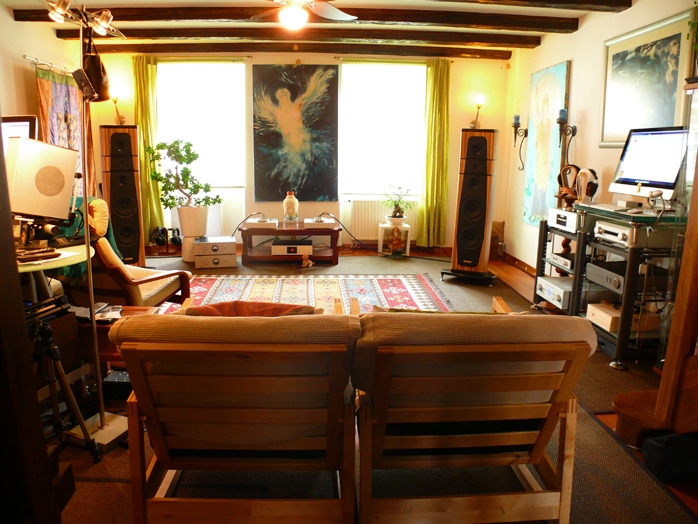
Locate an element on the screen. Image resolution: width=698 pixels, height=524 pixels. computer is located at coordinates (662, 174).